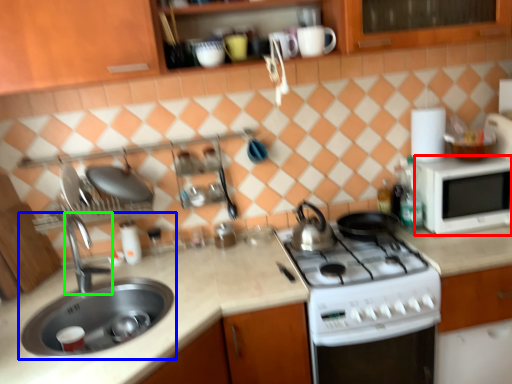
Question: Estimate the real-world distances between objects in this image. Which object is closer to microwave oven (highlighted by a red box), sink (highlighted by a blue box) or tap (highlighted by a green box)?

Choices:
 (A) sink
 (B) tap

Answer: (A)